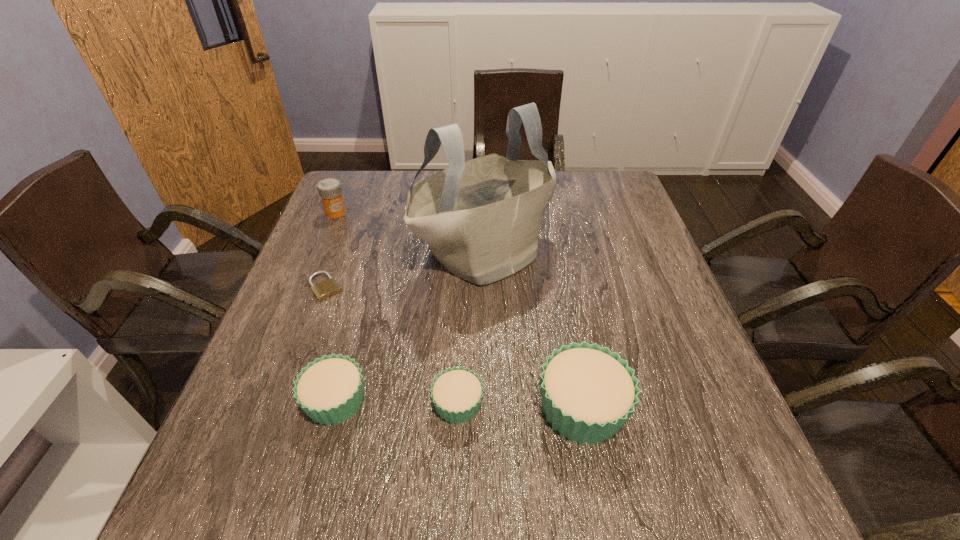
Please point a spot on the right to add another cupcake. Please provide its 2D coordinates. Your answer should be formatted as a tuple, i.e. [(x, y)], where the tuple contains the x and y coordinates of a point satisfying the conditions above.

[(708, 411)]